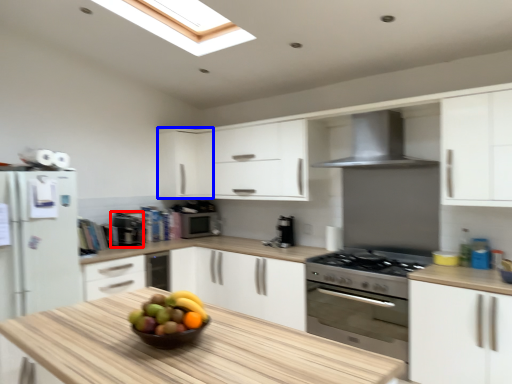
Question: Which of the following is the farthest to the observer, appliance (highlighted by a red box) or cabinetry (highlighted by a blue box)?

Choices:
 (A) appliance
 (B) cabinetry

Answer: (B)